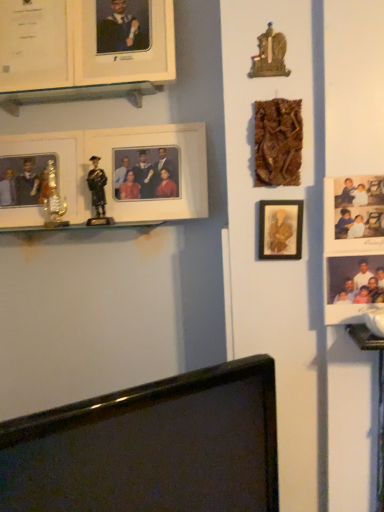
Question: From the image's perspective, is matte black figure at left above or below white matte picture frame at upper left, which is counted as the 3th picture frame, starting from the back?

Choices:
 (A) below
 (B) above

Answer: (A)

Question: In terms of height, does matte black figure at left look taller or shorter compared to white matte picture frame at upper left, which is counted as the 3th picture frame, starting from the back?

Choices:
 (A) short
 (B) tall

Answer: (A)

Question: Based on their relative distances, which object is farther from the matte gold picture frame at center-right, which ranks as the fifth picture frame in back-to-front order?

Choices:
 (A) metallic gold trophy at left, marked as the 6th picture frame in a front-to-back arrangement
 (B) wooden carving at upper right, positioned as the 1th picture frame in front-to-back order
 (C) black glossy monitor at bottom
 (D) white matte picture frame at upper left, acting as the fifth picture frame starting from the front
 (E) matte black figure at left

Answer: (A)

Question: Which object is positioned farthest from the white matte picture frame at upper left, the fourth picture frame positioned from the front?

Choices:
 (A) wooden statue at upper right
 (B) white matte picture frame at upper left, the second picture frame viewed from the back
 (C) matte white picture frame at upper left, acting as the 3th picture frame starting from the front
 (D) matte gold picture frame at center-right, which ranks as the fifth picture frame in back-to-front order
 (E) matte black figure at left

Answer: (D)